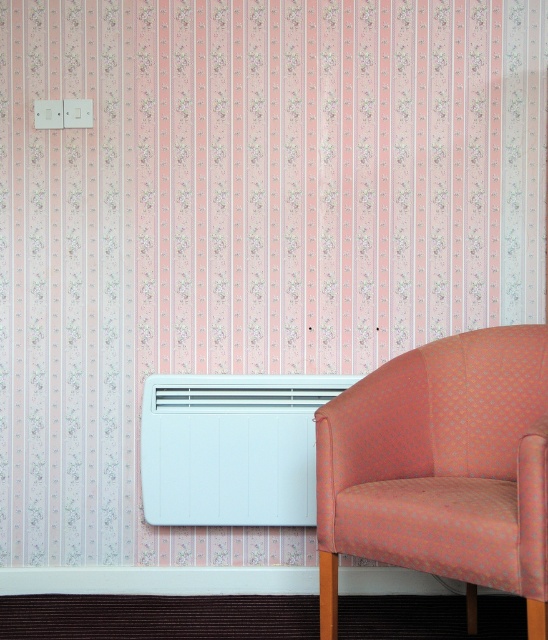
Question: Which point is closer to the camera?

Choices:
 (A) orange fabric armchair at lower right
 (B) white matte air conditioner at lower center

Answer: (A)

Question: Is orange fabric armchair at lower right closer to camera compared to white matte air conditioner at lower center?

Choices:
 (A) yes
 (B) no

Answer: (A)

Question: Does orange fabric armchair at lower right have a smaller size compared to white matte air conditioner at lower center?

Choices:
 (A) yes
 (B) no

Answer: (B)

Question: Does orange fabric armchair at lower right appear under white matte air conditioner at lower center?

Choices:
 (A) no
 (B) yes

Answer: (A)

Question: Which of the following is the closest to the observer?

Choices:
 (A) white matte air conditioner at lower center
 (B) orange fabric armchair at lower right

Answer: (B)